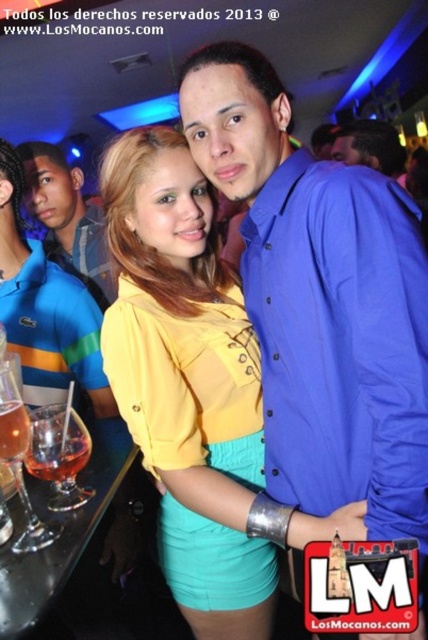
You are at a party and want to grab your drink without moving your arm from your current position. You have the blue striped polo shirt at left on your left arm. Is the translucent glass drink at lower left accessible to you?

The translucent glass drink at lower left is behind the blue striped polo shirt at left, so you cannot reach it without moving your arm.